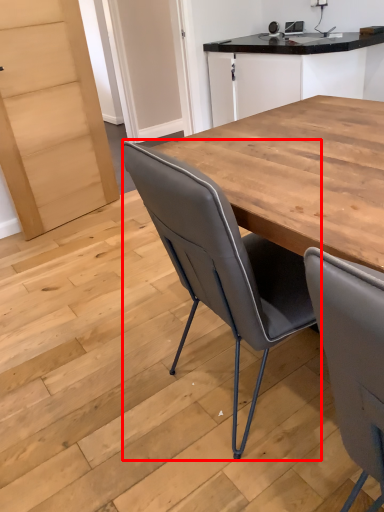
Question: From the image's perspective, where is chair (annotated by the red box) located relative to cabinetry?

Choices:
 (A) above
 (B) below

Answer: (B)